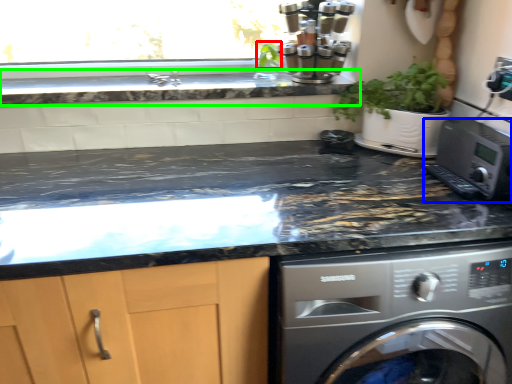
Question: Estimate the real-world distances between objects in this image. Which object is closer to plant (highlighted by a red box), home appliance (highlighted by a blue box) or countertop (highlighted by a green box)?

Choices:
 (A) home appliance
 (B) countertop

Answer: (B)